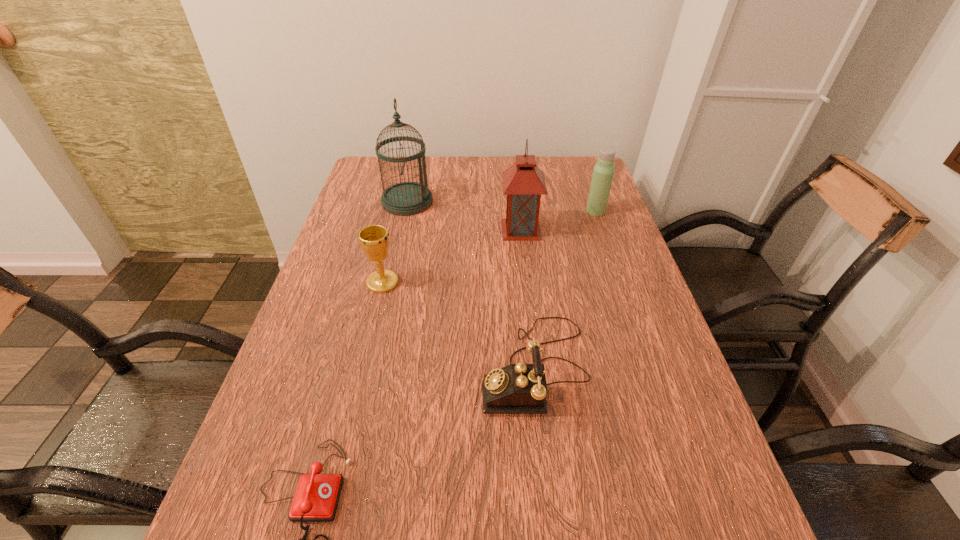
The image size is (960, 540). In order to click on the second closest object to the watch in this screenshot , I will do `click(520, 388)`.